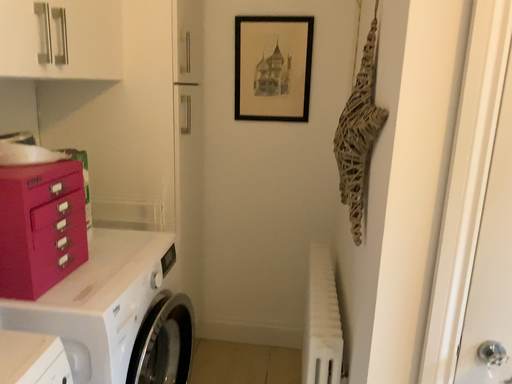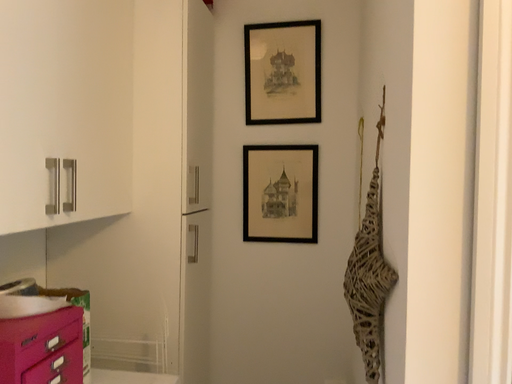
Question: How did the camera likely rotate when shooting the video?

Choices:
 (A) rotated upward
 (B) rotated downward

Answer: (A)